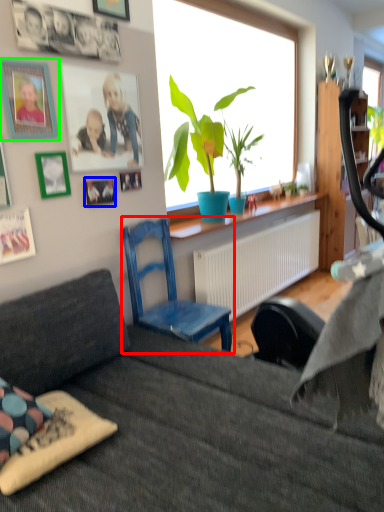
Question: Which object is positioned closest to chair (highlighted by a red box)? Select from picture frame (highlighted by a blue box) and picture frame (highlighted by a green box).

Choices:
 (A) picture frame
 (B) picture frame

Answer: (A)